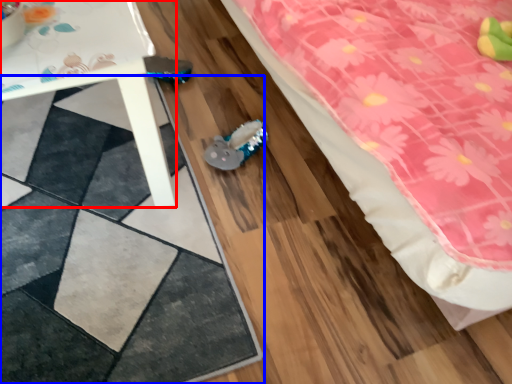
Question: Which object appears farthest to the camera in this image, table (highlighted by a red box) or square (highlighted by a blue box)?

Choices:
 (A) table
 (B) square

Answer: (B)